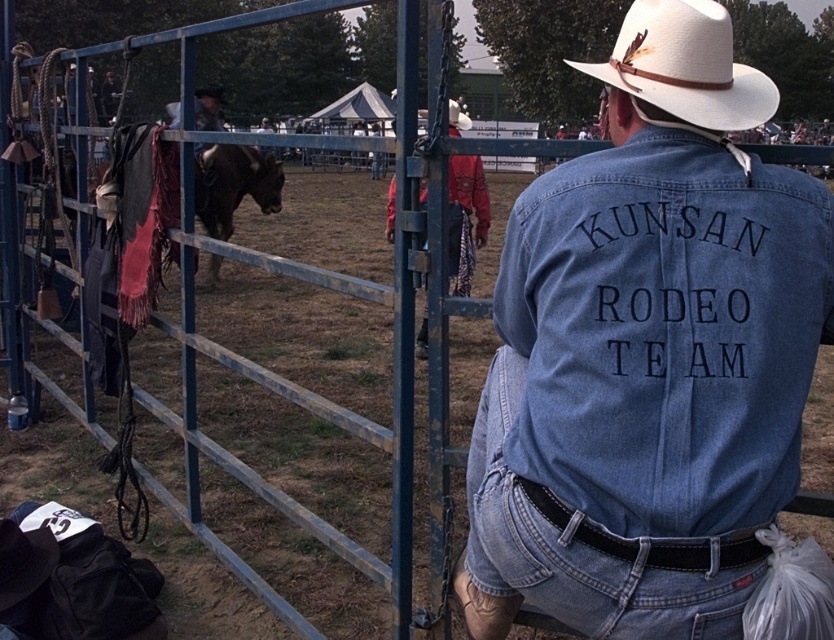
You are a photographer at the rodeo event. You want to take a photo of the natural straw cowboy hat at upper center and the brown leather horse at center. Which object should you zoom in more on to ensure both are in focus?

The natural straw cowboy hat at upper center might be wider than the brown leather horse at center, so you should zoom in more on the natural straw cowboy hat at upper center to ensure both are in focus.

You are a photographer at the rodeo event. You need to capture a photo of the denim at back and the brown leather horse at center. Which object should you zoom in on to ensure both are in focus without moving the camera?

The denim at back is not as tall as the brown leather horse at center, so you should zoom in on the brown leather horse at center to ensure both are in focus.

You are a photographer at the rodeo event and need to position yourself to capture both the denim jacket at center and the horse in the scene. Based on their positions, which object is closer to the camera?

The denim jacket at center is closer to the camera because it is located at point (649, 353), which is closer in the coordinate system compared to the horse whose position isn not specified but typically in such scenes the central objects are foreground elements.